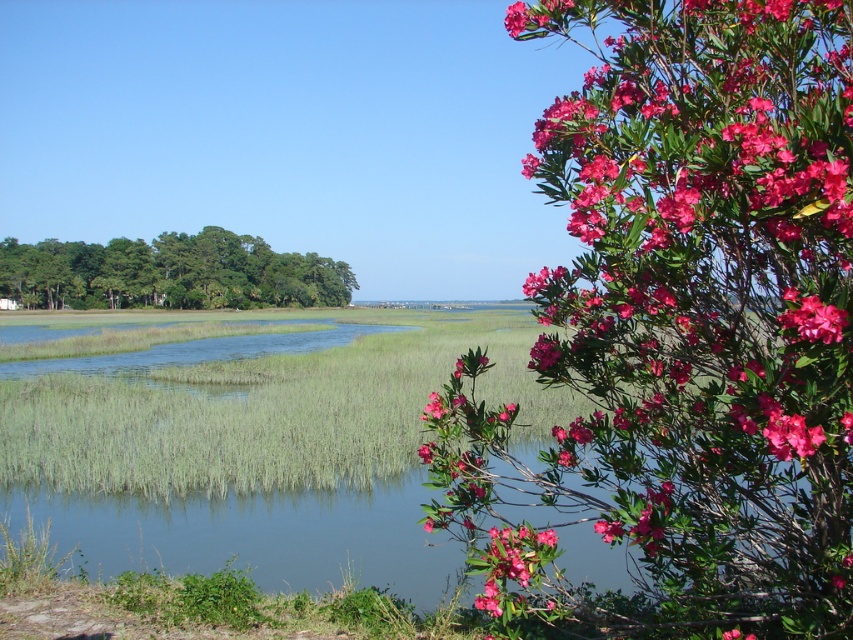
You are a painter standing in the middle of the wetland area. You want to paint the pink glossy flowers at upper right and the green leafy trees at left. Which object should you paint first if you want to paint from left to right?

The green leafy trees at left should be painted first since they are positioned to the left of the pink glossy flowers at upper right.

You are an ornithologist observing birds in the marsh. You notice the pink glossy flowers at upper right and the green leafy trees at left. Which object is closer to the water surface?

The pink glossy flowers at upper right are positioned over the green leafy trees at left, meaning they are closer to the water surface than the trees.

You are a botanist examining two pink flowers in the upper right corner of the image. The first is labeled as pink glossy flowers at upper right and the second as pink matte flower at upper right. Which of these two flowers has a wider appearance?

The pink glossy flowers at upper right are wider than the pink matte flower at upper right according to the description.